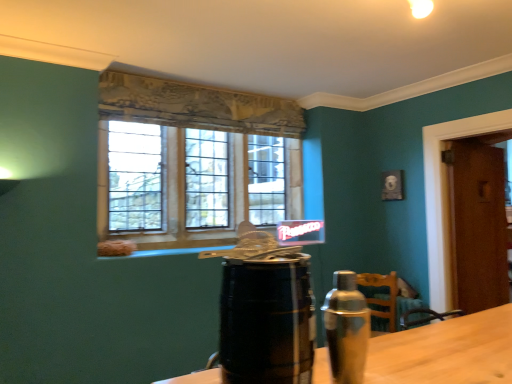
This screenshot has height=384, width=512. Find the location of `brown wooden door at right`. brown wooden door at right is located at coordinates pos(477,224).

In order to click on clear glass window at center in this screenshot , I will do `click(193, 162)`.

You are a GUI agent. You are given a task and a screenshot of the screen. Output one action in this format:
    pyautogui.click(x=<x>, y=<y>)
    Task: Click on the black wooden barrel at center
    
    Given the screenshot: What is the action you would take?
    pyautogui.click(x=267, y=321)

Does brown wooden door at right turn towards black wooden barrel at center?

No.

Which is more to the right, brown wooden door at right or black wooden barrel at center?

brown wooden door at right is more to the right.

Relative to black wooden barrel at center, is brown wooden door at right in front or behind?

brown wooden door at right is behind black wooden barrel at center.

Considering the sizes of silver metallic shaker at right and black wooden barrel at center in the image, is silver metallic shaker at right wider or thinner than black wooden barrel at center?

In the image, silver metallic shaker at right appears to be more narrow than black wooden barrel at center.

Does silver metallic shaker at right have a greater height compared to black wooden barrel at center?

No.

Would you say black wooden barrel at center is part of silver metallic shaker at right's contents?

No, silver metallic shaker at right does not contain black wooden barrel at center.

Locate an element on the screen. This screenshot has height=384, width=512. bottle behind the black wooden barrel at center is located at coordinates (346, 328).

Could you tell me if black wooden barrel at center is facing silver metallic shaker at right?

No, black wooden barrel at center does not turn towards silver metallic shaker at right.

Which object is further away from the camera taking this photo, black wooden barrel at center or silver metallic shaker at right?

silver metallic shaker at right is further away from the camera.

Considering the points (237, 351) and (348, 351), which point is in front, point (237, 351) or point (348, 351)?

The point (237, 351) is closer to the camera.

How much distance is there between black wooden barrel at center and silver metallic shaker at right?

5.45 inches.

From a real-world perspective, which object rests below the other?

From a 3D spatial view, black wooden barrel at center is below.

From the image's perspective, between clear glass window at center and black wooden barrel at center, who is located below?

From the image's view, black wooden barrel at center is below.

Is clear glass window at center with black wooden barrel at center?

No, clear glass window at center is not touching black wooden barrel at center.

Is point (110, 235) positioned behind point (280, 322)?

Yes, point (110, 235) is farther from viewer.

Find the location of `bottle beneath the brown wooden door at right (from a real-world perspective)`. bottle beneath the brown wooden door at right (from a real-world perspective) is located at coordinates (346, 328).

Considering the relative positions of brown wooden door at right and silver metallic shaker at right in the image provided, is brown wooden door at right in front of silver metallic shaker at right?

No, brown wooden door at right is behind silver metallic shaker at right.

Would you say brown wooden door at right is a long distance from silver metallic shaker at right?

brown wooden door at right is far away from silver metallic shaker at right.

Is point (460, 232) positioned after point (359, 294)?

Yes, it is.

Does brown wooden door at right have a lesser width compared to clear glass window at center?

Indeed, brown wooden door at right has a lesser width compared to clear glass window at center.

From the image's perspective, is brown wooden door at right beneath clear glass window at center?

Yes.

Is brown wooden door at right shorter than clear glass window at center?

No.

Is clear glass window at center at the back of brown wooden door at right?

brown wooden door at right is not turned away from clear glass window at center.

From a real-world perspective, is silver metallic shaker at right on brown wooden door at right?

No, from a real-world perspective, silver metallic shaker at right is not above brown wooden door at right.

Between silver metallic shaker at right and brown wooden door at right, which one appears on the left side from the viewer's perspective?

silver metallic shaker at right is more to the left.

Which object is wider, silver metallic shaker at right or brown wooden door at right?

Wider between the two is brown wooden door at right.

Does silver metallic shaker at right have a lesser height compared to brown wooden door at right?

Yes, silver metallic shaker at right is shorter than brown wooden door at right.

The width and height of the screenshot is (512, 384). What are the coordinates of `door that is above the black wooden barrel at center (from a real-world perspective)` in the screenshot? It's located at (x=477, y=224).

Locate an element on the screen. beverage to the left of silver metallic shaker at right is located at coordinates click(267, 321).

Which object lies nearer to the anchor point clear glass window at center, black wooden barrel at center or silver metallic shaker at right?

Based on the image, silver metallic shaker at right appears to be nearer to clear glass window at center.

Consider the image. From the image, which object appears to be farther from silver metallic shaker at right, brown wooden door at right or clear glass window at center?

brown wooden door at right.

Which object lies nearer to the anchor point black wooden barrel at center, clear glass window at center or brown wooden door at right?

The object closer to black wooden barrel at center is clear glass window at center.

Considering their positions, is brown wooden door at right positioned further to clear glass window at center than black wooden barrel at center?

The object further to clear glass window at center is black wooden barrel at center.

Based on their spatial positions, is clear glass window at center or brown wooden door at right further from silver metallic shaker at right?

Among the two, brown wooden door at right is located further to silver metallic shaker at right.

Considering their positions, is black wooden barrel at center positioned closer to clear glass window at center than brown wooden door at right?

brown wooden door at right is positioned closer to the anchor clear glass window at center.

From the image, which object appears to be farther from silver metallic shaker at right, black wooden barrel at center or clear glass window at center?

clear glass window at center lies further to silver metallic shaker at right than the other object.

Considering their positions, is clear glass window at center positioned further to brown wooden door at right than silver metallic shaker at right?

Based on the image, silver metallic shaker at right appears to be further to brown wooden door at right.

I want to click on bottle between black wooden barrel at center and clear glass window at center along the z-axis, so click(346, 328).

I want to click on window between black wooden barrel at center and brown wooden door at right from front to back, so click(193, 162).

Locate an element on the screen. The image size is (512, 384). window between silver metallic shaker at right and brown wooden door at right along the z-axis is located at coordinates (193, 162).

This screenshot has width=512, height=384. I want to click on bottle between black wooden barrel at center and brown wooden door at right in the front-back direction, so click(x=346, y=328).